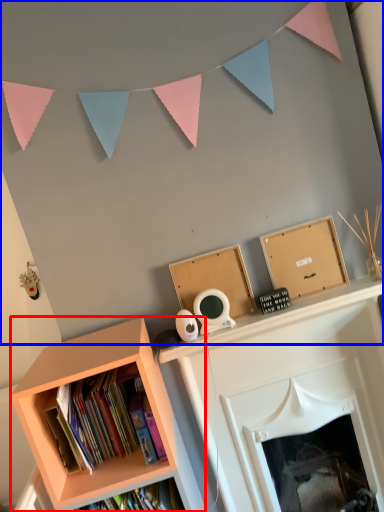
Question: Which of the following is the farthest to the observer, bookcase (highlighted by a red box) or backdrop (highlighted by a blue box)?

Choices:
 (A) bookcase
 (B) backdrop

Answer: (B)